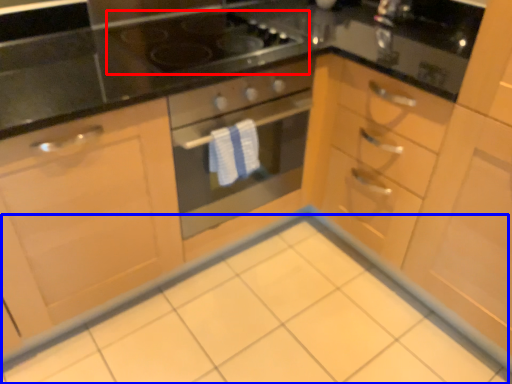
Question: Among these objects, which one is farthest to the camera, gas stove (highlighted by a red box) or ceramic tile (highlighted by a blue box)?

Choices:
 (A) gas stove
 (B) ceramic tile

Answer: (A)